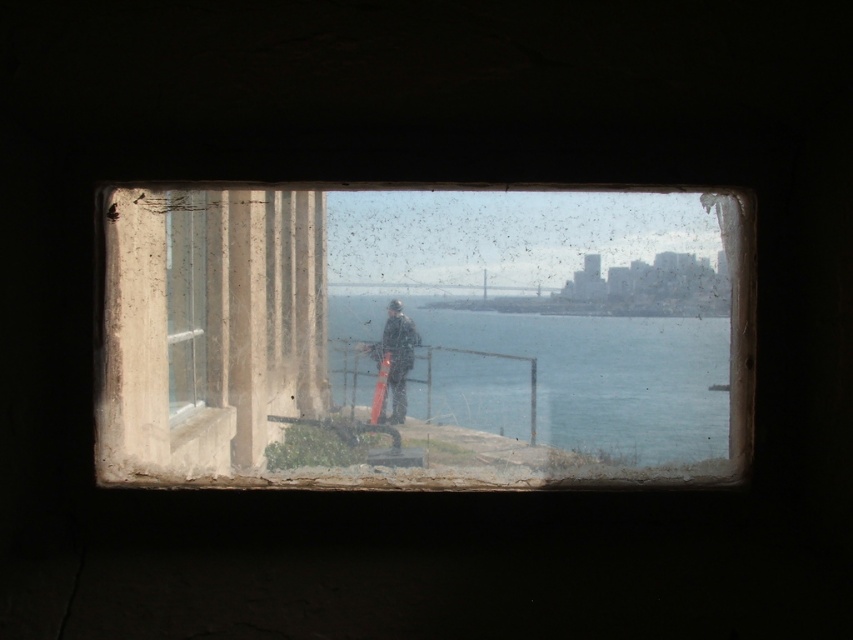
Question: Which of the following is the closest to the observer?

Choices:
 (A) dark gray fabric jacket at center
 (B) matte glass window at center

Answer: (B)

Question: Does clear blue water at center have a larger size compared to dark gray fabric jacket at center?

Choices:
 (A) no
 (B) yes

Answer: (B)

Question: Which point is farther to the camera?

Choices:
 (A) pos(412,348)
 (B) pos(585,369)
 (C) pos(456,323)

Answer: (A)

Question: From the image, what is the correct spatial relationship of matte glass window at center in relation to dark gray fabric jacket at center?

Choices:
 (A) below
 (B) above

Answer: (B)

Question: Does matte glass window at center have a larger size compared to dark gray fabric jacket at center?

Choices:
 (A) no
 (B) yes

Answer: (B)

Question: Considering the real-world distances, which object is closest to the matte glass window at center?

Choices:
 (A) dark gray fabric jacket at center
 (B) clear blue water at center

Answer: (B)